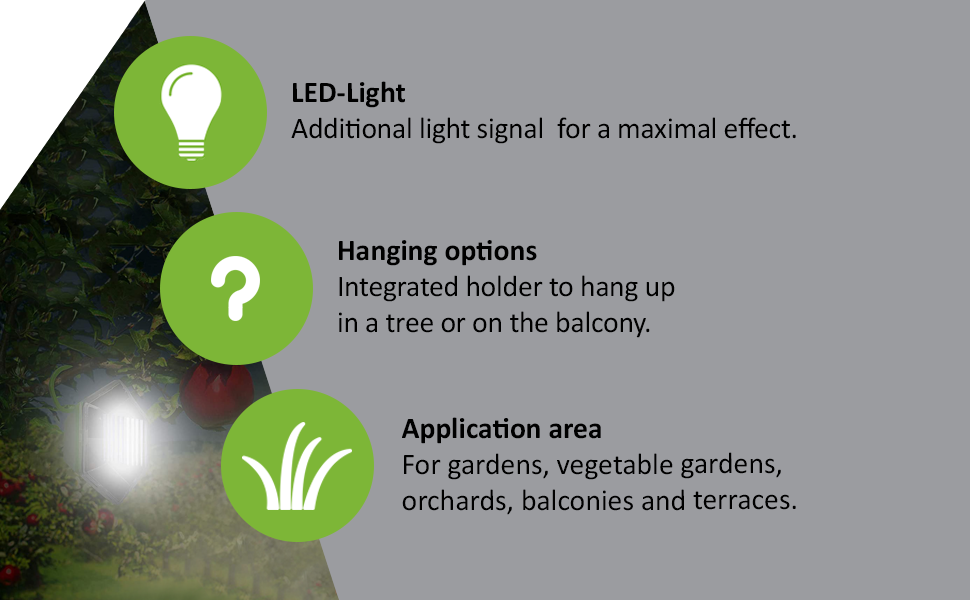
At what (x,y) coordinates should I click in order to perform the action: click on blank space next to led light. Please return your answer as a coordinate pair (x, y). The image size is (970, 600). Looking at the image, I should click on (464, 85).